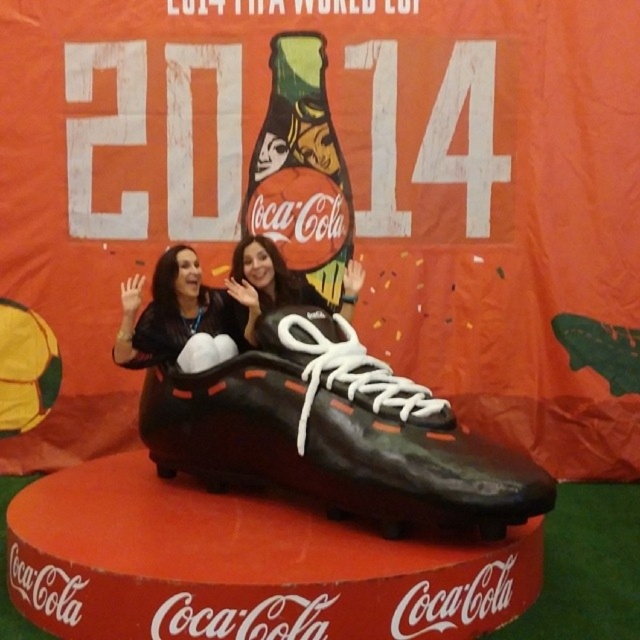
You are standing in front of the Coca Cola promotional setup and want to take a photo. You notice two points marked in the image. Which of these points is closer to your camera? The points are point 1 at coordinates point [301,419] and point 2 at coordinates point [228,276].

Point 1 at coordinates point [301,419] is closer to the camera than point 2 at coordinates point [228,276].

Consider the image. You are a photographer positioned at the point with coordinates (x=301, y=170). You need to capture a photo of the green matte coca cola bottle at center. Is the bottle within your current field of view?

The green matte coca cola bottle at center is exactly at the point you are positioned at, so yes, it is directly in your field of view.